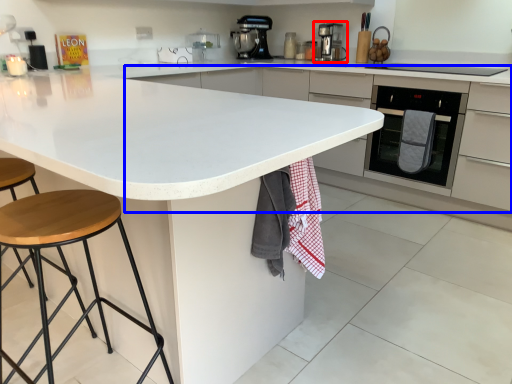
Question: Which object appears closest to the camera in this image, kitchen appliance (highlighted by a red box) or cabinetry (highlighted by a blue box)?

Choices:
 (A) kitchen appliance
 (B) cabinetry

Answer: (B)